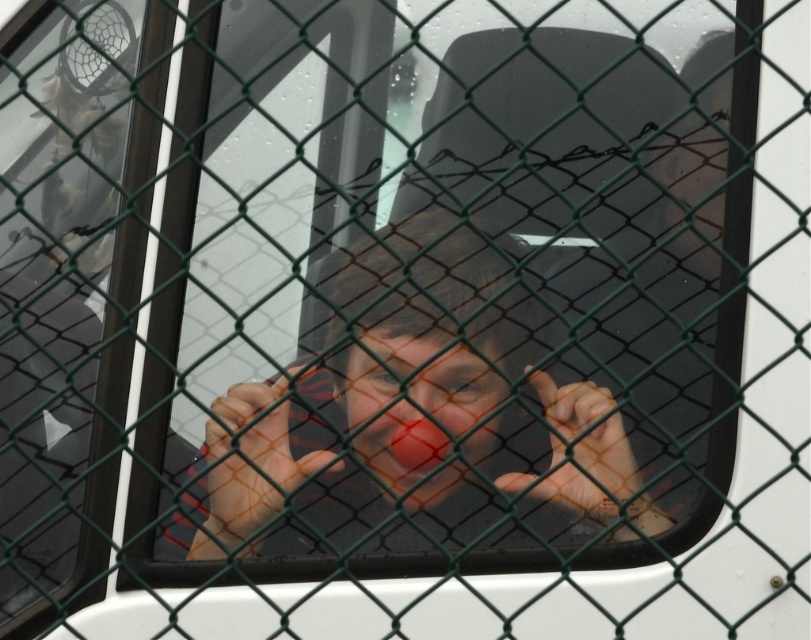
Question: Does matte red clown nose at center appear over red matte clown nose at center?

Choices:
 (A) no
 (B) yes

Answer: (A)

Question: Which point is farther to the camera?

Choices:
 (A) red matte clown nose at center
 (B) matte red clown nose at center

Answer: (A)

Question: Can you confirm if matte red clown nose at center is thinner than red matte clown nose at center?

Choices:
 (A) yes
 (B) no

Answer: (B)

Question: Is matte red clown nose at center wider than red matte clown nose at center?

Choices:
 (A) yes
 (B) no

Answer: (A)

Question: Which object is farther from the camera taking this photo?

Choices:
 (A) matte red clown nose at center
 (B) red matte clown nose at center

Answer: (B)

Question: Which point is closer to the camera?

Choices:
 (A) (485, 454)
 (B) (479, 378)

Answer: (A)